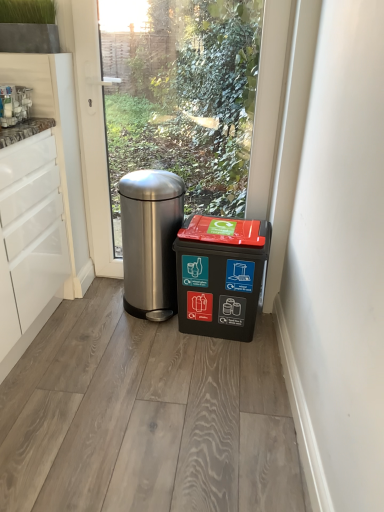
Where is `vacant space situated on the left part of polished stainless steel trash can at center, positioned as the first waste container in left-to-right order`? This screenshot has height=512, width=384. vacant space situated on the left part of polished stainless steel trash can at center, positioned as the first waste container in left-to-right order is located at coordinates (97, 302).